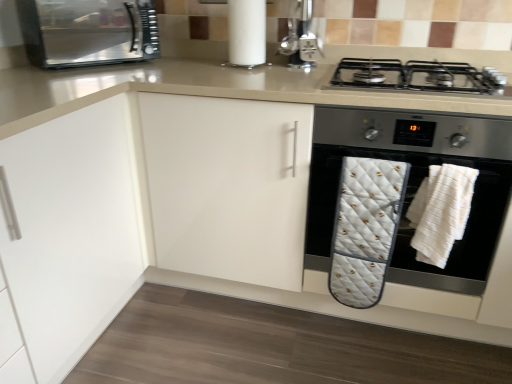
Question: Considering the relative positions of metallic stainless steel microwave at upper left and black matte gas stove at upper right in the image provided, is metallic stainless steel microwave at upper left to the right of black matte gas stove at upper right from the viewer's perspective?

Choices:
 (A) yes
 (B) no

Answer: (B)

Question: Is metallic stainless steel microwave at upper left further to camera compared to black matte gas stove at upper right?

Choices:
 (A) no
 (B) yes

Answer: (B)

Question: From a real-world perspective, is metallic stainless steel microwave at upper left on top of black matte gas stove at upper right?

Choices:
 (A) yes
 (B) no

Answer: (A)

Question: Is metallic stainless steel microwave at upper left taller than black matte gas stove at upper right?

Choices:
 (A) no
 (B) yes

Answer: (B)

Question: Considering the relative positions of metallic stainless steel microwave at upper left and black matte gas stove at upper right in the image provided, is metallic stainless steel microwave at upper left to the left of black matte gas stove at upper right from the viewer's perspective?

Choices:
 (A) yes
 (B) no

Answer: (A)

Question: From a real-world perspective, is metallic silver coffee machine at upper center above or below white textured bath towel at lower right, which is counted as the first bath towel, starting from the right?

Choices:
 (A) below
 (B) above

Answer: (B)

Question: From the image's perspective, is metallic silver coffee machine at upper center above or below white textured bath towel at lower right, which is counted as the first bath towel, starting from the right?

Choices:
 (A) above
 (B) below

Answer: (A)

Question: Does point (288, 46) appear closer or farther from the camera than point (452, 244)?

Choices:
 (A) closer
 (B) farther

Answer: (B)

Question: From their relative heights in the image, would you say metallic silver coffee machine at upper center is taller or shorter than white textured bath towel at lower right, which is counted as the first bath towel, starting from the right?

Choices:
 (A) short
 (B) tall

Answer: (A)

Question: From their relative heights in the image, would you say black matte gas stove at upper right is taller or shorter than white textured bath towel at lower right, the 2th bath towel from the left?

Choices:
 (A) short
 (B) tall

Answer: (A)

Question: Considering the positions of point [x=450, y=67] and point [x=467, y=196], is point [x=450, y=67] closer or farther from the camera than point [x=467, y=196]?

Choices:
 (A) farther
 (B) closer

Answer: (A)

Question: Is black matte gas stove at upper right wider or thinner than white textured bath towel at lower right, the 2th bath towel from the left?

Choices:
 (A) wide
 (B) thin

Answer: (A)

Question: From a real-world perspective, is black matte gas stove at upper right physically located above or below white textured bath towel at lower right, which is counted as the first bath towel, starting from the right?

Choices:
 (A) below
 (B) above

Answer: (B)

Question: Based on their sizes in the image, would you say white quilted oven mitt at lower right is bigger or smaller than white textured bath towel at lower right, which is counted as the first bath towel, starting from the right?

Choices:
 (A) big
 (B) small

Answer: (A)

Question: From a real-world perspective, is white quilted oven mitt at lower right above or below white textured bath towel at lower right, which is counted as the first bath towel, starting from the right?

Choices:
 (A) below
 (B) above

Answer: (B)